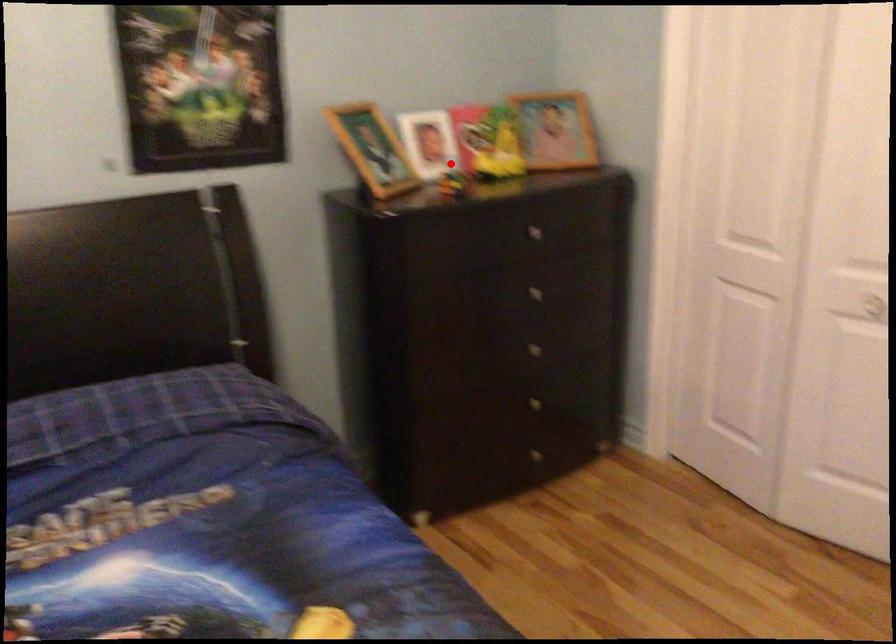
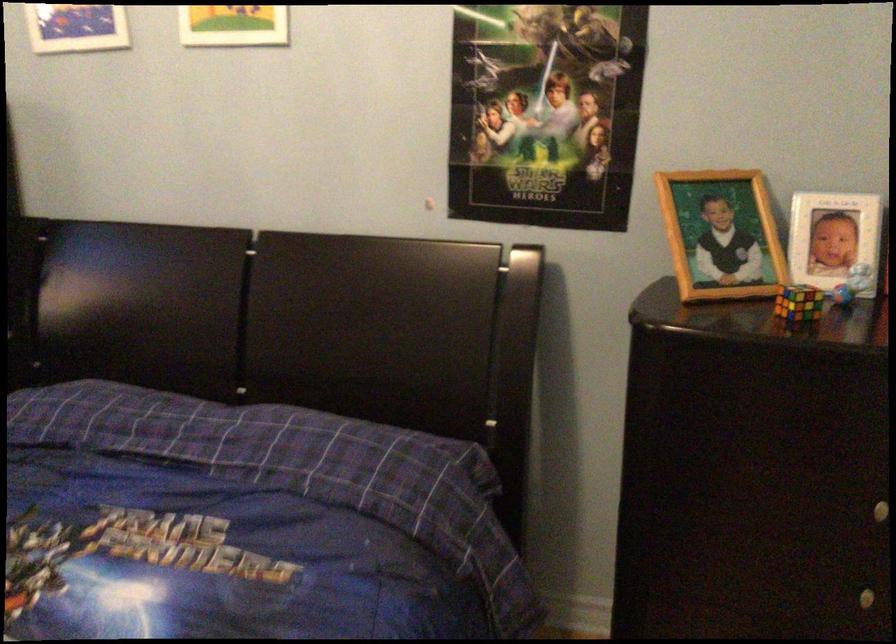
Question: I am providing you with two images of the same scene from different viewpoints. Image1 has a red point marked. In image2, the corresponding 3D location appears at what relative position? Reply with the corresponding letter.

Choices:
 (A) Closer
 (B) Farther

Answer: (A)